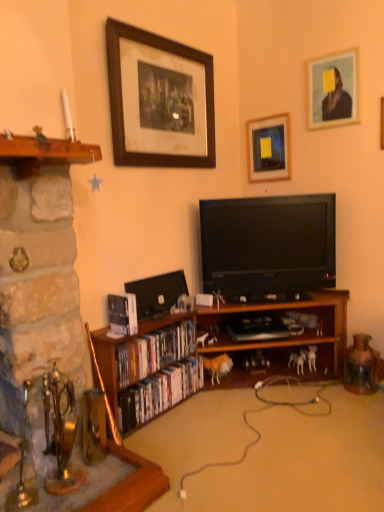
Locate an element on the screen. This screenshot has height=512, width=384. vacant point above wooden framed print at upper center, acting as the 1th picture frame starting from the left (from a real-world perspective) is located at coordinates (167, 39).